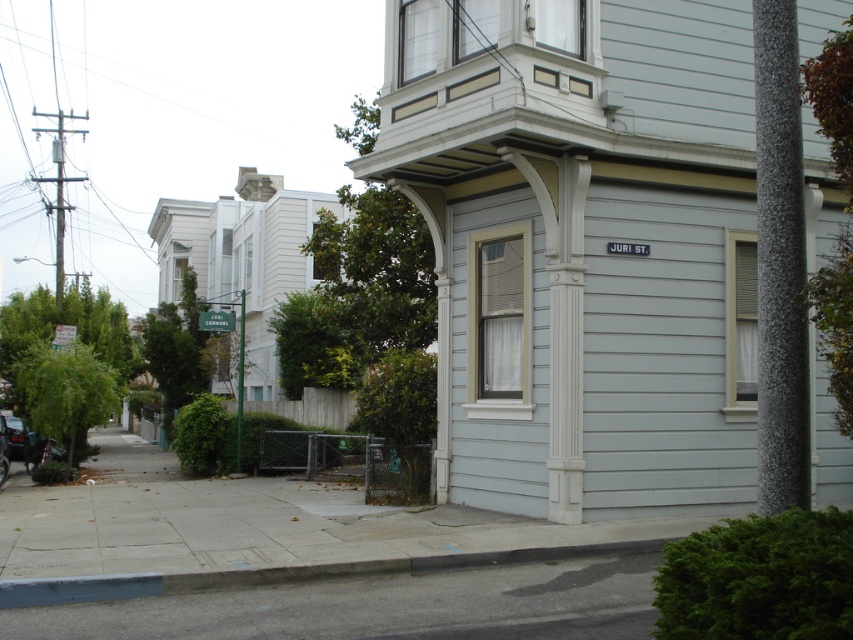
Is gray speckled pole at right wider than gray concrete curb at lower center?

No.

Looking at this image, is gray speckled pole at right above gray concrete curb at lower center?

Yes, gray speckled pole at right is above gray concrete curb at lower center.

Does point (761, 385) come behind point (271, 582)?

No, (761, 385) is closer to viewer.

Identify the location of gray speckled pole at right. The width and height of the screenshot is (853, 640). (780, 264).

Between gray concrete curb at lower center and shiny black car at lower left, which one appears on the left side from the viewer's perspective?

Positioned to the left is shiny black car at lower left.

How much distance is there between gray concrete curb at lower center and shiny black car at lower left?

gray concrete curb at lower center and shiny black car at lower left are 62.61 feet apart.

Describe the element at coordinates (292, 573) in the screenshot. Image resolution: width=853 pixels, height=640 pixels. I see `gray concrete curb at lower center` at that location.

At what (x,y) coordinates should I click in order to perform the action: click on gray concrete curb at lower center. Please return your answer as a coordinate pair (x, y). This screenshot has height=640, width=853. Looking at the image, I should click on (292, 573).

Measure the distance between gray speckled pole at right and camera.

5.26 meters

Can you confirm if gray speckled pole at right is positioned above shiny black car at lower left?

Yes, gray speckled pole at right is above shiny black car at lower left.

Who is more forward, [782,202] or [9,436]?

Positioned in front is point [782,202].

In order to click on gray speckled pole at right in this screenshot , I will do 780,264.